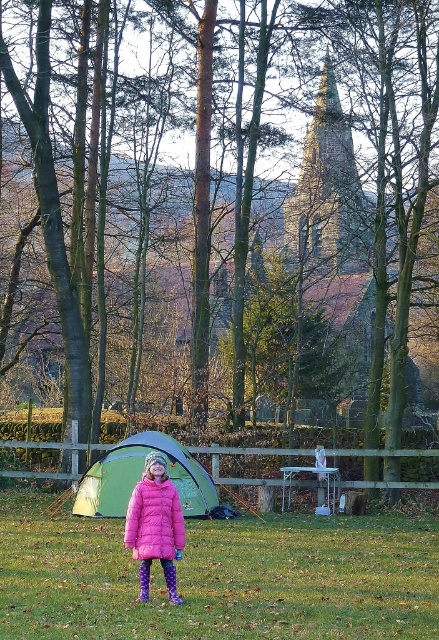
Please provide the coordinates of the pink down jacket at center in the image. The coordinates should be in the format of a point with two decimal places, such as point (154, 520).

The pink down jacket at center is represented by point (154, 520).

In the scene shown: You are a parent trying to ensure your child stays within a safe distance from the wooden fence. The wooden fence is located in the middle ground of the image. Given that the green grass at center and purple fabric boot at lower center are 13.04 feet apart, can you determine if the child is within a 10 feet safety zone from the fence?

The green grass at center and purple fabric boot at lower center are 13.04 feet apart. Since the distance between them exceeds 10 feet, the child is outside the 10 feet safety zone from the fence.

You are a photographer trying to capture the green fabric tent at center and the purple fabric boot at lower center in the same frame. Based on their heights, which object will appear taller in the photo?

The green fabric tent at center will appear taller in the photo since it has a greater height compared to the purple fabric boot at lower center.